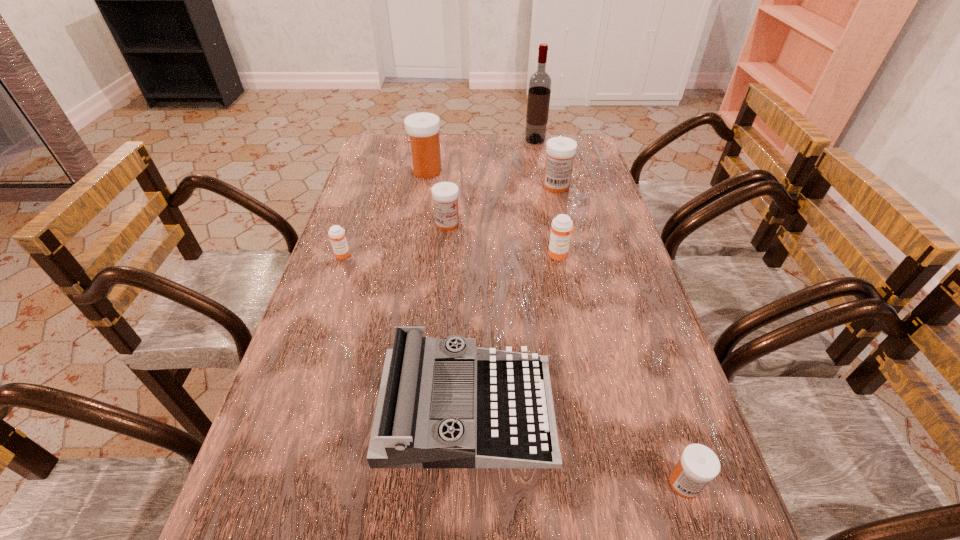
This screenshot has height=540, width=960. I want to click on vacant region at the far right corner, so click(581, 133).

The height and width of the screenshot is (540, 960). I want to click on vacant region between the third farthest white medicine and the black typewriter, so click(x=457, y=316).

This screenshot has width=960, height=540. I want to click on free space that is in between the second nearest white medicine and the left orange medicine, so click(x=395, y=239).

At what (x,y) coordinates should I click in order to perform the action: click on unoccupied position between the smallest white medicine and the tallest object. Please return your answer as a coordinate pair (x, y). Looking at the image, I should click on (610, 312).

Find the location of a particular element. free spot between the tallest object and the black typewriter is located at coordinates (501, 275).

Where is `vacant region between the bigger orange medicine and the rightmost white medicine`? The image size is (960, 540). vacant region between the bigger orange medicine and the rightmost white medicine is located at coordinates (622, 369).

You are a GUI agent. You are given a task and a screenshot of the screen. Output one action in this format:
    pyautogui.click(x=<x>, y=<y>)
    Task: Click on the free point between the typewriter and the wine bottle
    The height and width of the screenshot is (540, 960).
    Given the screenshot: What is the action you would take?
    pyautogui.click(x=501, y=275)

Select which object appears as the seventh closest to the right orange medicine. Please provide its 2D coordinates. Your answer should be formatted as a tuple, i.e. [(x, y)], where the tuple contains the x and y coordinates of a point satisfying the conditions above.

[(539, 91)]

Identify the location of object that ranks as the fifth closest to the right orange medicine. The image size is (960, 540). (336, 233).

The height and width of the screenshot is (540, 960). What are the coordinates of `medicine that is the closest one to the smaller orange medicine` in the screenshot? It's located at (445, 195).